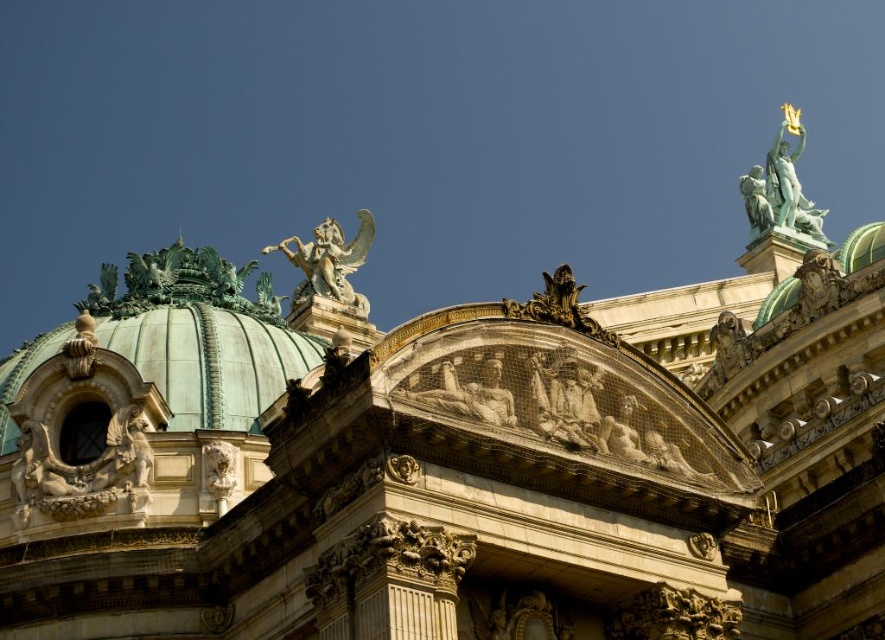
Is green polished statue at upper right shorter than marble relief figure at center?

In fact, green polished statue at upper right may be taller than marble relief figure at center.

Does green polished statue at upper right have a smaller size compared to marble relief figure at center?

No.

At what (x,y) coordinates should I click in order to perform the action: click on green polished statue at upper right. Please return your answer as a coordinate pair (x, y). Looking at the image, I should click on (781, 186).

Find the location of `green polished statue at upper right`. green polished statue at upper right is located at coordinates (781, 186).

Who is positioned more to the left, green polished statue at upper right or green stone winged creature at upper center?

Positioned to the left is green stone winged creature at upper center.

The width and height of the screenshot is (885, 640). What are the coordinates of `green polished statue at upper right` in the screenshot? It's located at (781, 186).

Consider the image. Can you confirm if green stone winged creature at upper center is taller than marble relief figure at center?

Yes.

This screenshot has width=885, height=640. What are the coordinates of `green stone winged creature at upper center` in the screenshot? It's located at (329, 260).